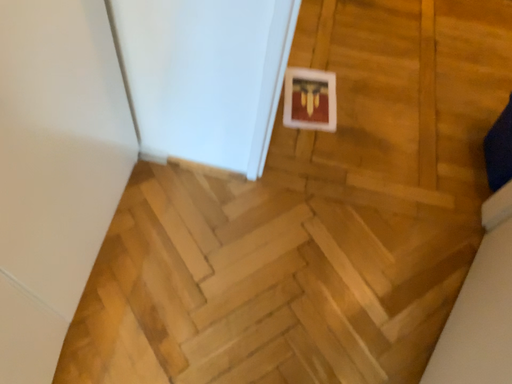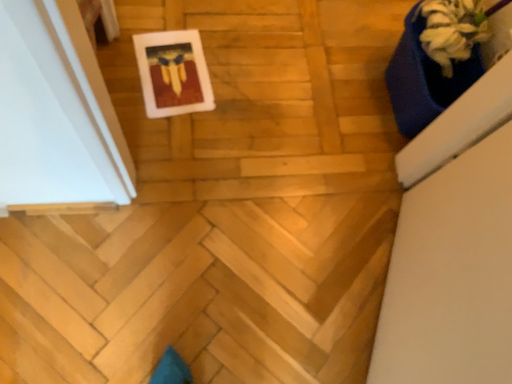
Question: How did the camera likely rotate when shooting the video?

Choices:
 (A) rotated left
 (B) rotated right

Answer: (B)